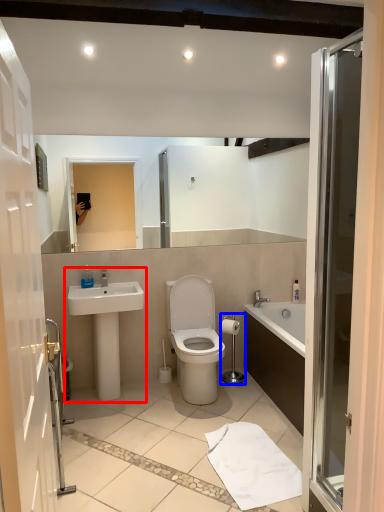
Question: Which object appears farthest to the camera in this image, sink (highlighted by a red box) or towel bar (highlighted by a blue box)?

Choices:
 (A) sink
 (B) towel bar

Answer: (B)